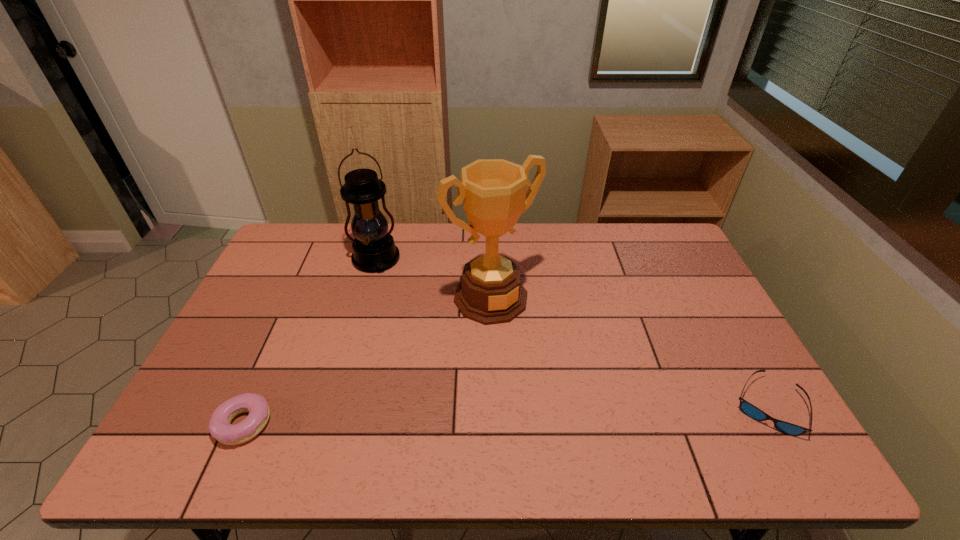
Identify the location of free point located on the front-facing side of the second object from right to left. The height and width of the screenshot is (540, 960). (588, 418).

I want to click on vacant space situated 0.260m on the front-facing side of the second object from right to left, so click(x=565, y=389).

Find the location of a particular element. object that is at the far edge is located at coordinates (374, 250).

Find the location of a particular element. This screenshot has width=960, height=540. doughnut that is positioned at the near edge is located at coordinates (220, 427).

Where is `sunglasses at the near edge`? Image resolution: width=960 pixels, height=540 pixels. sunglasses at the near edge is located at coordinates (747, 408).

Identify the location of object present at the left edge. The image size is (960, 540). (220, 427).

I want to click on object present at the right edge, so click(747, 408).

Identify the location of object that is at the near left corner. (220, 427).

In order to click on object positioned at the near right corner in this screenshot , I will do `click(747, 408)`.

Where is `vacant space at the far edge of the desktop`? This screenshot has width=960, height=540. vacant space at the far edge of the desktop is located at coordinates (578, 223).